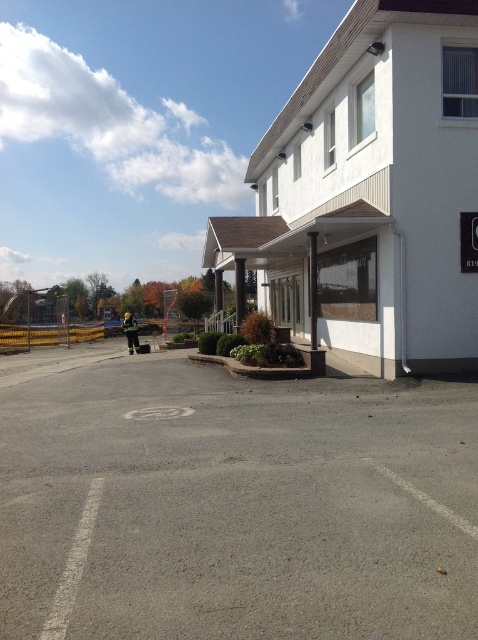
You are a delivery driver who needs to park your truck in the gray asphalt parking lot at center. The truck requires a space of 6 meters to park safely. Can you fit the truck in the parking lot without hitting the white smooth building at center?

The distance between the gray asphalt parking lot at center and the white smooth building at center is 6.34 meters. Since the truck needs 6 meters, it should fit with some space to spare.

You are standing at the point labeled point (33, 596) and want to walk to point (445, 316). Which direction should you move relative to your current position?

You should move towards the upper right direction from your current position at point (33, 596) to reach point (445, 316).

You are a delivery driver who needs to park your vehicle in the gray asphalt parking lot at center. The entrance to the white smooth building at center is on the right side of the building. Which direction should you approach the parking lot from to easily access the building entrance?

You should approach the gray asphalt parking lot at center from the right side to easily access the entrance of the white smooth building at center, since the parking lot is located to the left of the building.